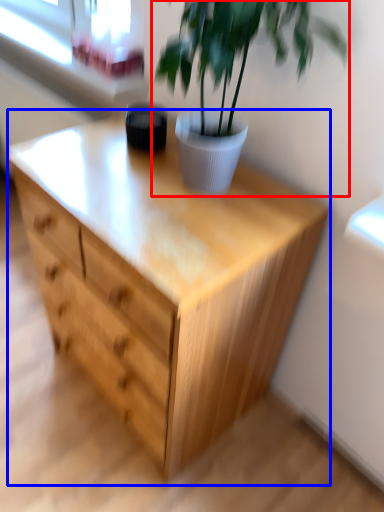
Question: Which point is closer to the camera, houseplant (highlighted by a red box) or chest of drawers (highlighted by a blue box)?

Choices:
 (A) houseplant
 (B) chest of drawers

Answer: (A)